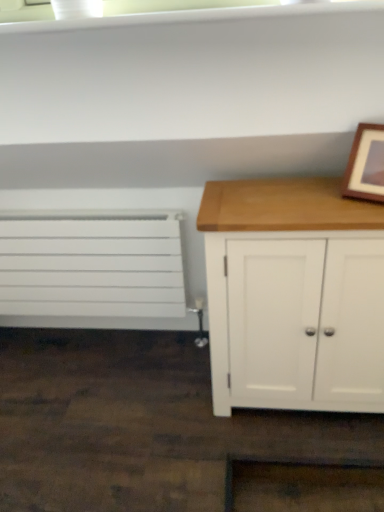
Locate an element on the screen. The image size is (384, 512). vacant area on top of white wood cabinet at right (from a real-world perspective) is located at coordinates (284, 198).